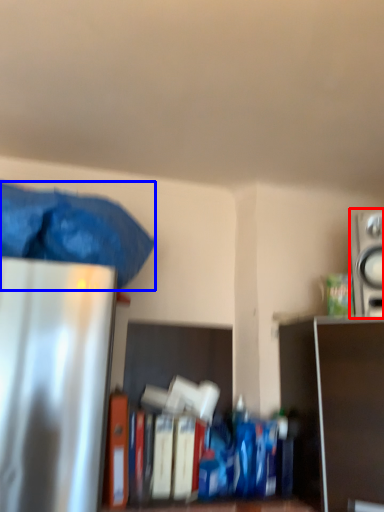
Question: Which point is further to the camera, appliance (highlighted by a red box) or waste (highlighted by a blue box)?

Choices:
 (A) appliance
 (B) waste

Answer: (A)